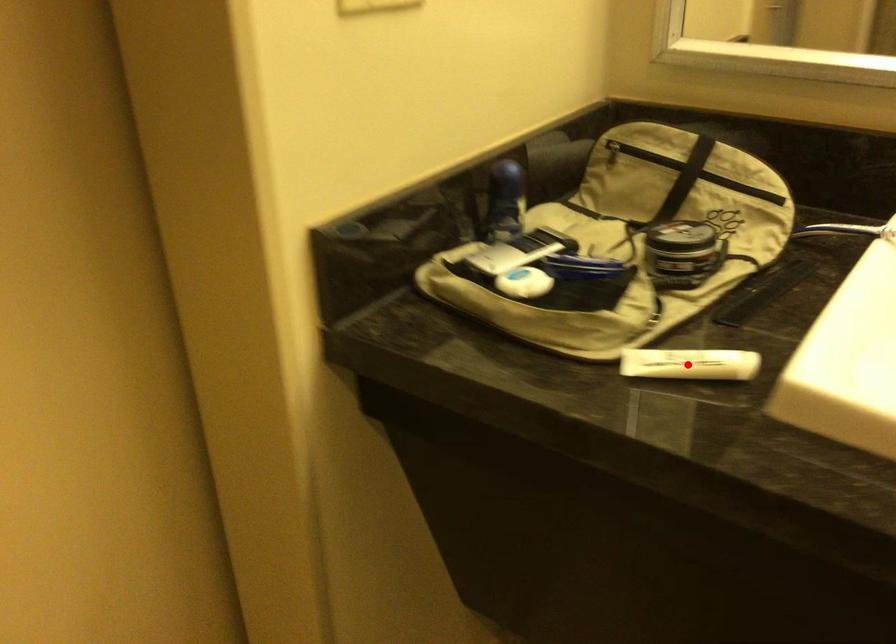
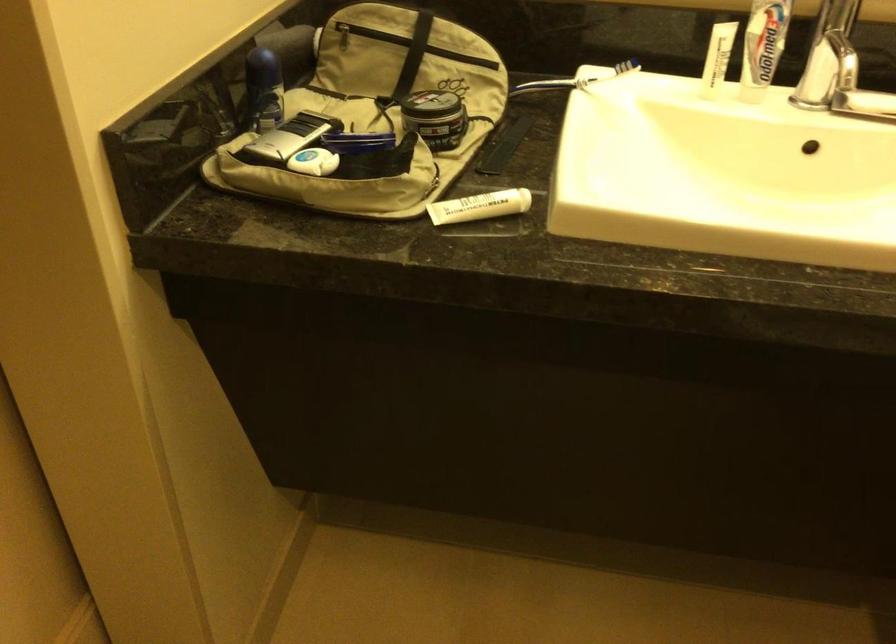
Question: I am providing you with two images of the same scene from different viewpoints. Image1 has a red point marked. In image2, the corresponding 3D location appears at what relative position? Reply with the corresponding letter.

Choices:
 (A) Closer
 (B) Farther

Answer: (B)